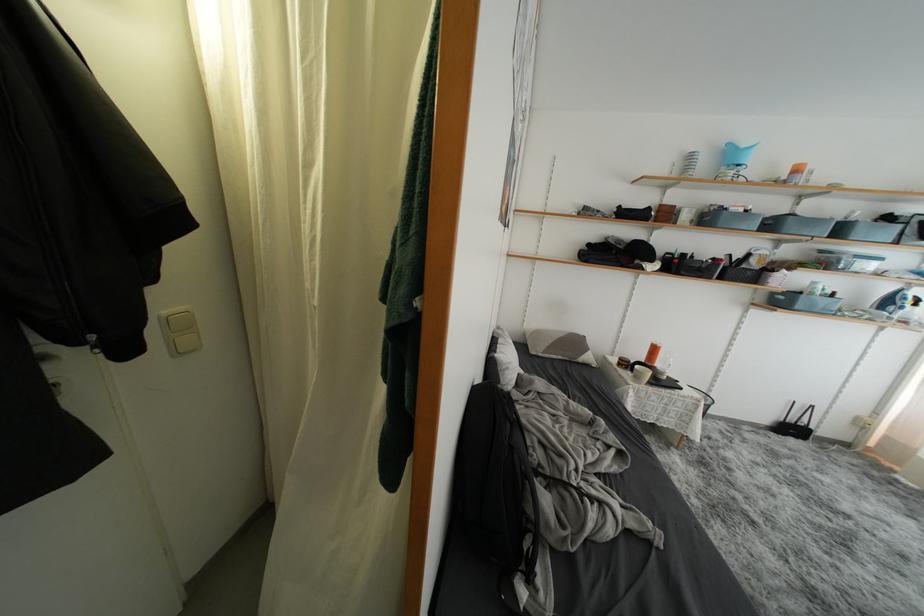
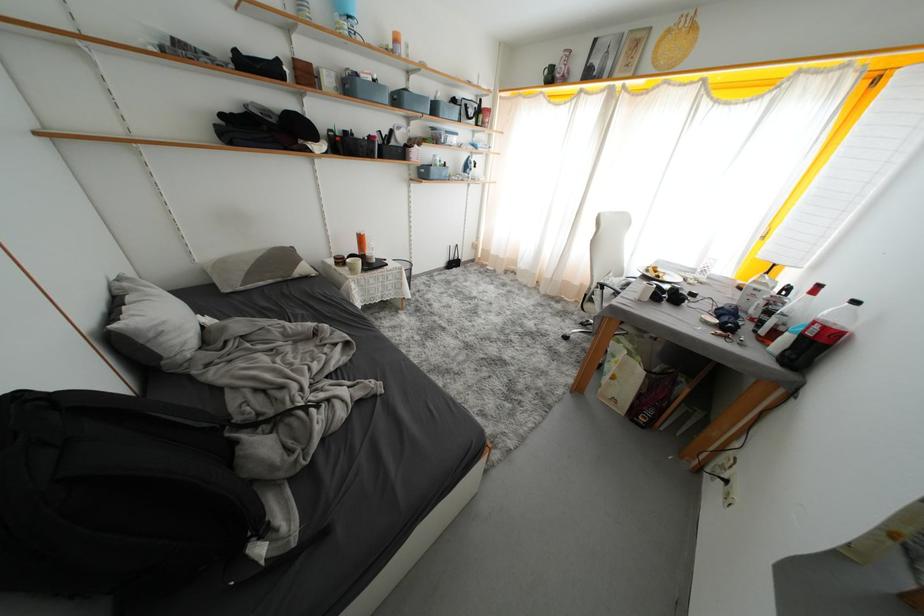
Where in the second image is the point corresponding to (x=755, y=259) from the first image?

(397, 136)